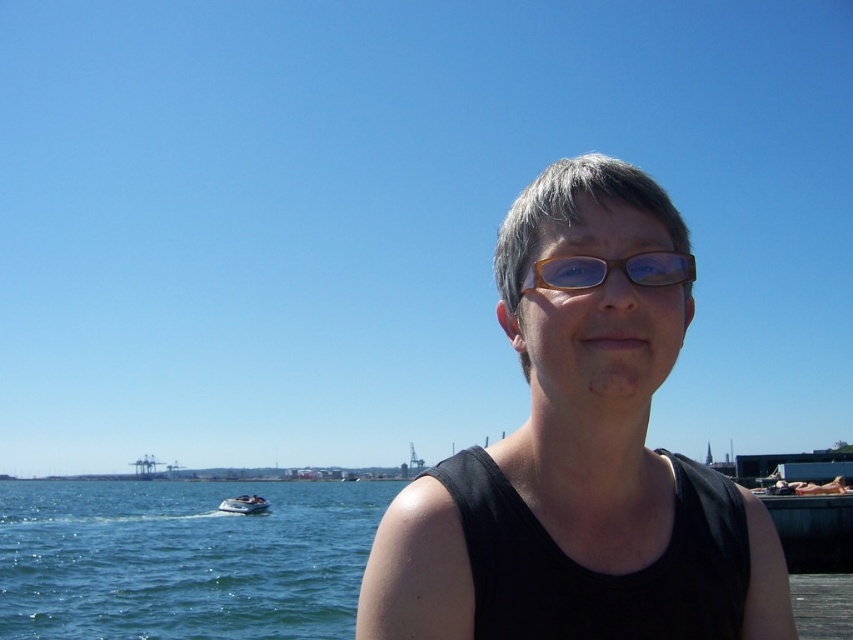
Question: Which point appears farthest from the camera in this image?

Choices:
 (A) (671, 268)
 (B) (697, 531)

Answer: (B)

Question: Which point appears farthest from the camera in this image?

Choices:
 (A) (619, 186)
 (B) (532, 275)
 (C) (230, 504)
 (D) (73, 516)

Answer: (D)

Question: Is black matte tank top at center positioned behind brown wooden glasses at center?

Choices:
 (A) yes
 (B) no

Answer: (B)

Question: Which of these objects is positioned closest to the blue water at lower left?

Choices:
 (A) brown wooden glasses at center
 (B) white glossy boat at lower left
 (C) black matte tank top at center

Answer: (B)

Question: Can you confirm if black matte tank top at center is positioned to the left of blue water at lower left?

Choices:
 (A) no
 (B) yes

Answer: (A)

Question: Is black matte tank top at center below white glossy boat at lower left?

Choices:
 (A) no
 (B) yes

Answer: (A)